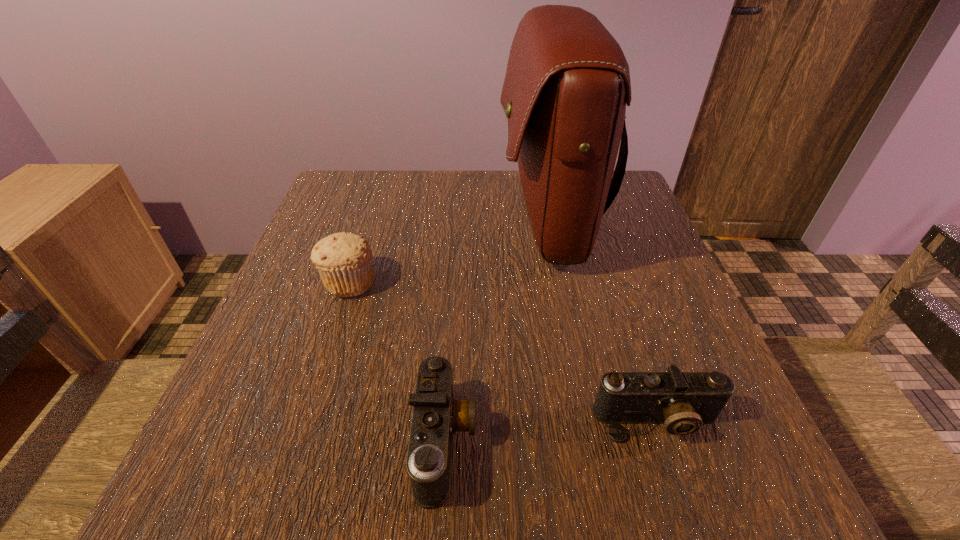
The height and width of the screenshot is (540, 960). Find the location of `vacant space located 0.070m on the lens of the left camera`. vacant space located 0.070m on the lens of the left camera is located at coordinates (524, 441).

Identify the location of object that is at the far edge. (567, 83).

Locate an element on the screen. object at the near edge is located at coordinates (437, 415).

Identify the location of object that is at the left edge. (344, 261).

This screenshot has width=960, height=540. In order to click on satchel that is at the right edge in this screenshot , I will do `click(567, 83)`.

Where is `camera situated at the right edge`? camera situated at the right edge is located at coordinates (683, 401).

Where is `object that is at the far right corner`? object that is at the far right corner is located at coordinates pos(567,83).

Locate an element on the screen. The height and width of the screenshot is (540, 960). vacant region at the far edge of the desktop is located at coordinates (394, 200).

Locate an element on the screen. vacant region at the near edge of the desktop is located at coordinates (335, 502).

This screenshot has height=540, width=960. What are the coordinates of `vacant space at the left edge` in the screenshot? It's located at (314, 344).